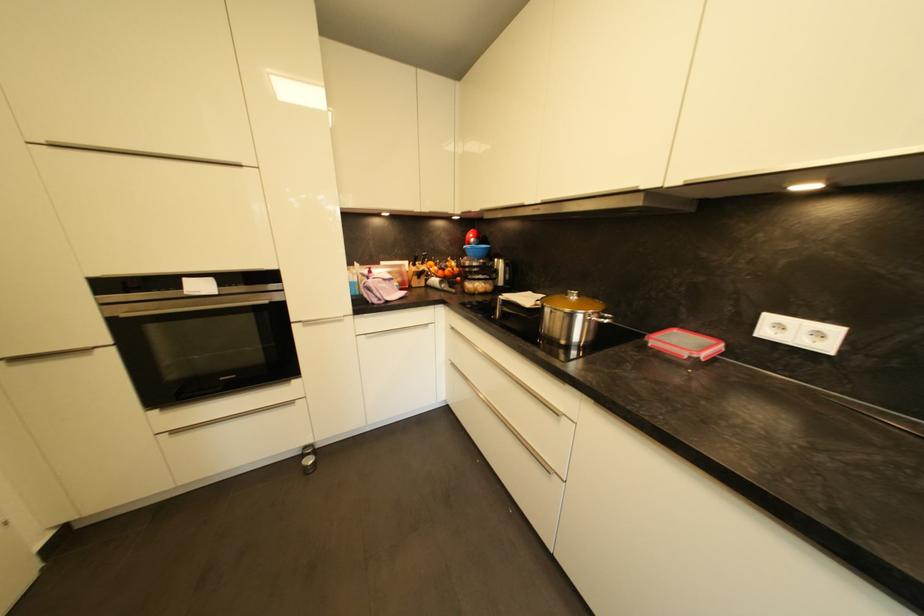
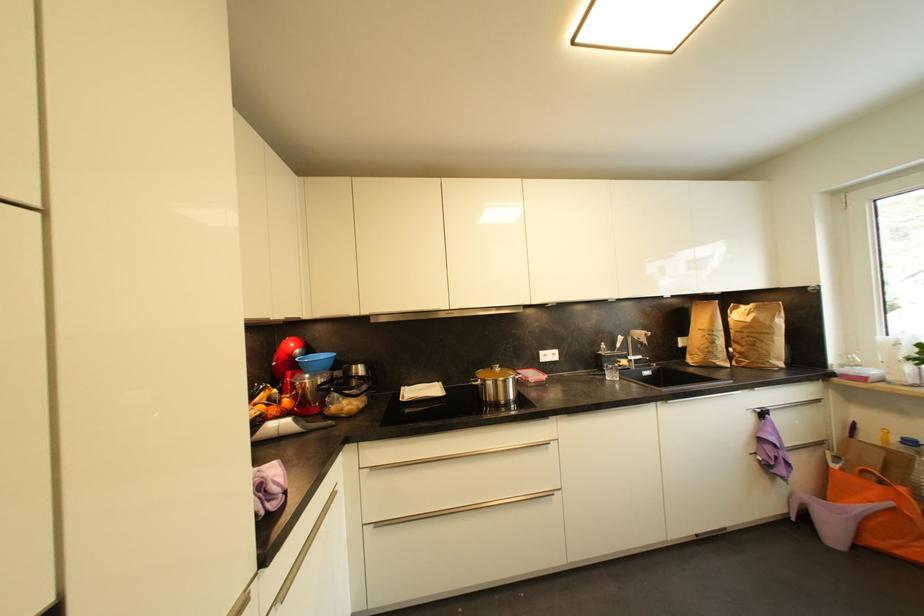
Where in the second image is the point corresponding to point (700, 333) from the first image?

(528, 371)